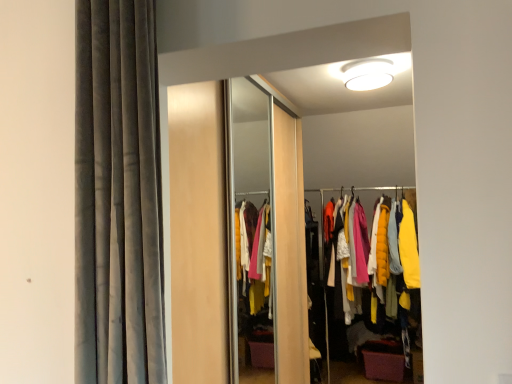
Describe the element at coordinates (355, 301) in the screenshot. This screenshot has width=512, height=384. I see `yellow quilted jacket at center` at that location.

Locate an element on the screen. The image size is (512, 384). yellow quilted jacket at center is located at coordinates (355, 301).

Identify the location of yellow quilted jacket at center. (355, 301).